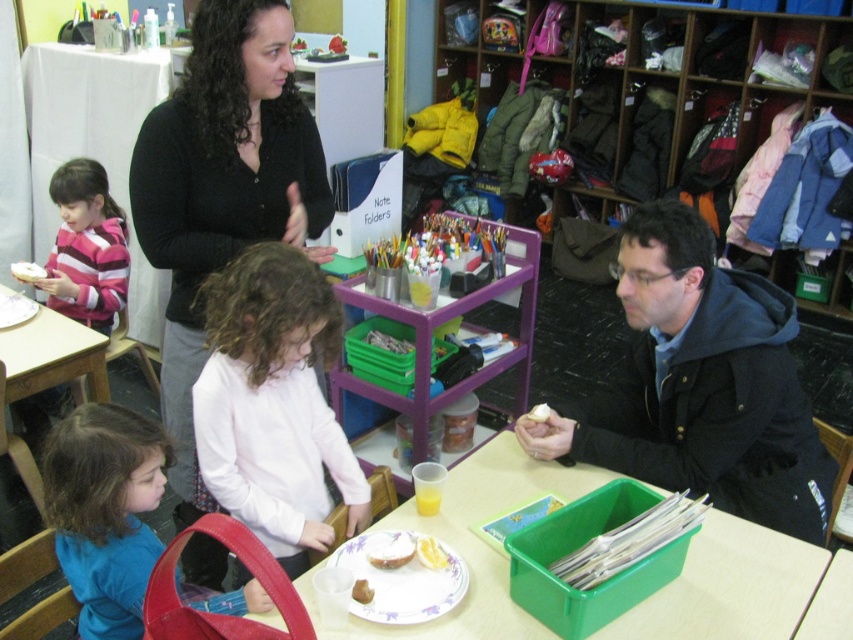
Question: Which of the following is the farthest from the observer?

Choices:
 (A) (384, 552)
 (B) (22, 428)
 (C) (57, 435)

Answer: (B)

Question: Considering the real-world distances, which object is closest to the white matte shirt at center?

Choices:
 (A) blue fabric shirt at lower left
 (B) yellow matte bread at lower center
 (C) black matte jacket at lower right
 (D) white matte bread at lower center

Answer: (A)

Question: Is the position of brown matte bread at lower center more distant than that of white matte bread at lower center?

Choices:
 (A) yes
 (B) no

Answer: (B)

Question: Which point appears farthest from the camera in this image?

Choices:
 (A) (413, 552)
 (B) (535, 413)
 (C) (219, 396)

Answer: (B)

Question: In this image, where is blue fabric shirt at lower left located relative to white matte bread at left?

Choices:
 (A) right
 (B) left

Answer: (A)

Question: Can you confirm if black matte jacket at lower right is smaller than yellow matte bread at lower center?

Choices:
 (A) no
 (B) yes

Answer: (A)